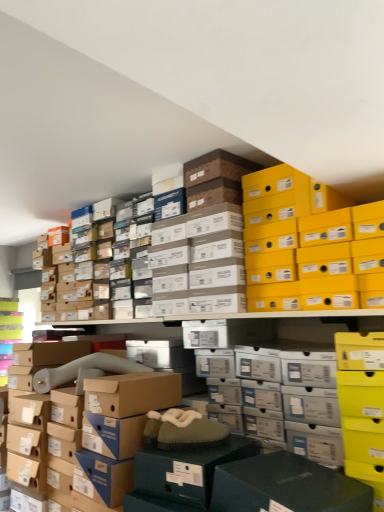
Question: In which direction should I rotate to look at brown cardboard box at center, which appears as the first storage box when ordered from the bottom?

Choices:
 (A) left
 (B) right

Answer: (A)

Question: Does brown cardboard box at center, the first storage box in the left-to-right sequence, have a lesser height compared to yellow matte shoebox at upper right, which appears as the 1th storage box when viewed from the top?

Choices:
 (A) no
 (B) yes

Answer: (A)

Question: Is brown cardboard box at center, which appears as the first storage box when ordered from the bottom, at the left side of yellow matte shoebox at upper right, which ranks as the second storage box in bottom-to-top order?

Choices:
 (A) no
 (B) yes

Answer: (B)

Question: Would you say brown cardboard box at center, which appears as the first storage box when ordered from the bottom, contains yellow matte shoebox at upper right, which appears as the 1th storage box when viewed from the top?

Choices:
 (A) no
 (B) yes

Answer: (A)

Question: Is yellow matte shoebox at upper right, which ranks as the second storage box in bottom-to-top order, at the back of brown cardboard box at center, which appears as the first storage box when ordered from the bottom?

Choices:
 (A) no
 (B) yes

Answer: (A)

Question: From a real-world perspective, is brown cardboard box at center, acting as the second storage box starting from the top, beneath yellow matte shoebox at upper right, the first storage box in the right-to-left sequence?

Choices:
 (A) yes
 (B) no

Answer: (A)

Question: Is the depth of brown cardboard box at center, the first storage box in the left-to-right sequence, greater than that of yellow matte shoebox at upper right, the second storage box viewed from the left?

Choices:
 (A) no
 (B) yes

Answer: (B)

Question: Considering the relative positions of yellow matte shoebox at upper right, which appears as the 1th storage box when viewed from the top, and brown cardboard box at center, the first storage box in the left-to-right sequence, in the image provided, is yellow matte shoebox at upper right, which appears as the 1th storage box when viewed from the top, behind brown cardboard box at center, the first storage box in the left-to-right sequence,?

Choices:
 (A) yes
 (B) no

Answer: (B)

Question: Can you confirm if yellow matte shoebox at upper right, the second storage box viewed from the left, is bigger than brown cardboard box at center, the first storage box in the left-to-right sequence?

Choices:
 (A) no
 (B) yes

Answer: (B)

Question: Is yellow matte shoebox at upper right, which appears as the 1th storage box when viewed from the top, wider than brown cardboard box at center, acting as the second storage box starting from the top?

Choices:
 (A) no
 (B) yes

Answer: (A)

Question: Is brown cardboard box at center, positioned as the 2th storage box in right-to-left order, located within yellow matte shoebox at upper right, the first storage box in the right-to-left sequence?

Choices:
 (A) no
 (B) yes

Answer: (A)

Question: From the image's perspective, does yellow matte shoebox at upper right, which appears as the 1th storage box when viewed from the top, appear lower than brown cardboard box at center, acting as the second storage box starting from the top?

Choices:
 (A) no
 (B) yes

Answer: (A)

Question: Is yellow matte shoebox at upper right, the first storage box in the right-to-left sequence, facing away from brown cardboard box at center, the first storage box in the left-to-right sequence?

Choices:
 (A) no
 (B) yes

Answer: (A)

Question: Is yellow matte shoebox at upper right, which ranks as the second storage box in bottom-to-top order, spatially inside brown cardboard box at center, acting as the second storage box starting from the top, or outside of it?

Choices:
 (A) inside
 (B) outside

Answer: (B)